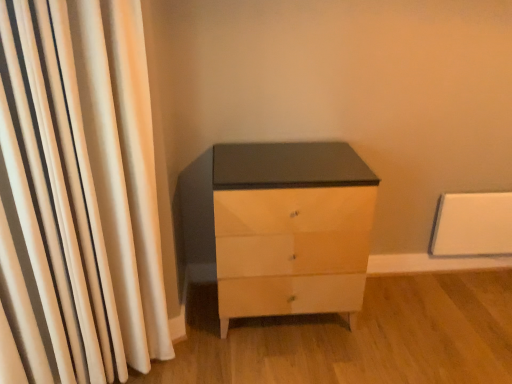
Identify the location of vacant area that is in front of matte white chest of drawers at center. (284, 360).